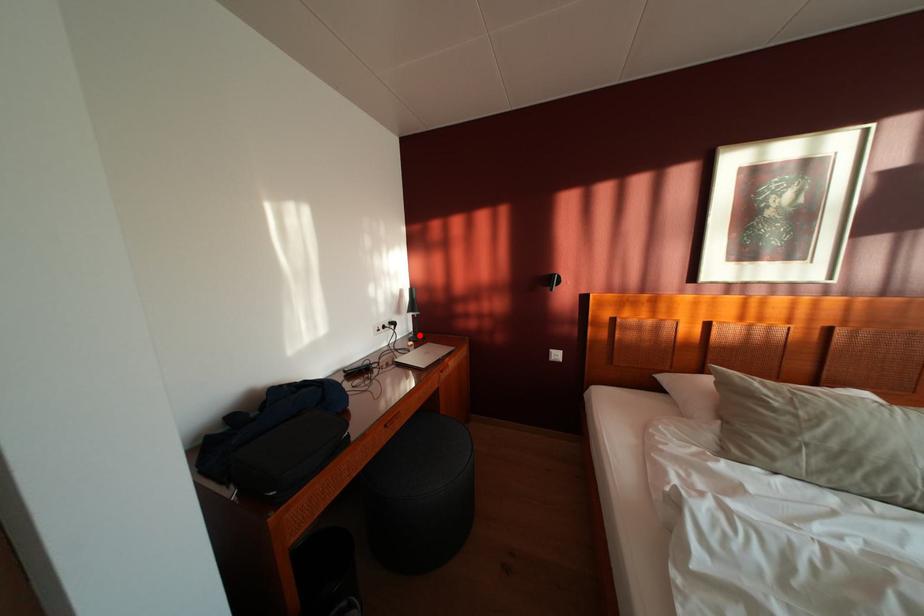
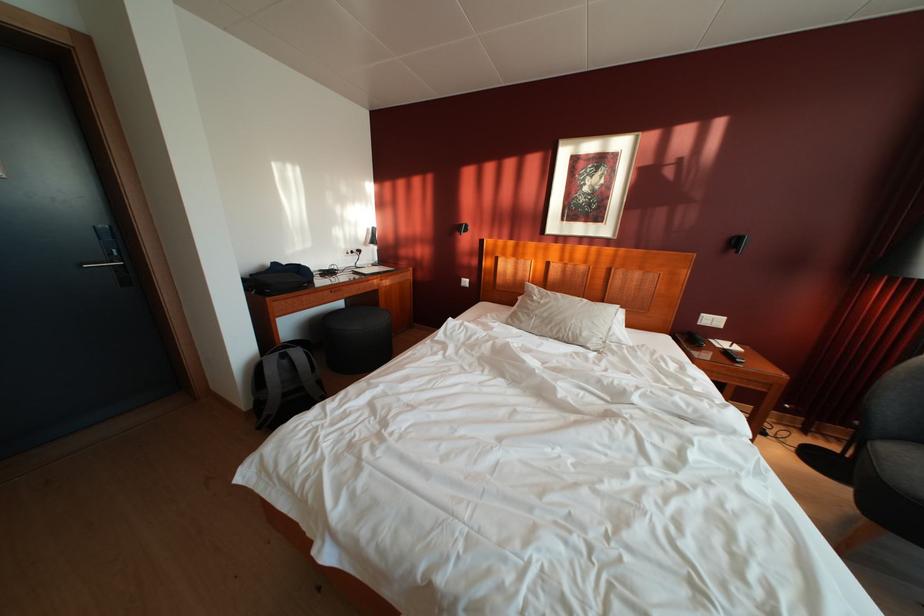
Question: I am providing you with two images of the same scene from different viewpoints. A red point is shown in image1. For the corresponding object point in image2, is it positioned nearer or farther from the camera?

Choices:
 (A) Nearer
 (B) Farther

Answer: (A)